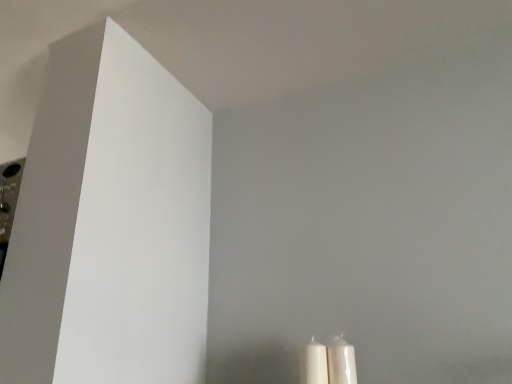
Question: Based on their sizes in the image, would you say white matte candle at lower right, the 2th candle when ordered from right to left, is bigger or smaller than white glossy candle at lower right, positioned as the first candle in right-to-left order?

Choices:
 (A) small
 (B) big

Answer: (B)

Question: Which is correct: white matte candle at lower right, which ranks as the first candle in left-to-right order, is inside white glossy candle at lower right, positioned as the first candle in right-to-left order, or outside of it?

Choices:
 (A) outside
 (B) inside

Answer: (A)

Question: In terms of height, does white matte candle at lower right, the 2th candle when ordered from right to left, look taller or shorter compared to white glossy candle at lower right, positioned as the first candle in right-to-left order?

Choices:
 (A) tall
 (B) short

Answer: (A)

Question: Is point (350, 374) closer or farther from the camera than point (311, 359)?

Choices:
 (A) farther
 (B) closer

Answer: (A)

Question: From their relative heights in the image, would you say white glossy candle at lower right, positioned as the first candle in right-to-left order, is taller or shorter than white matte candle at lower right, which ranks as the first candle in left-to-right order?

Choices:
 (A) short
 (B) tall

Answer: (A)

Question: From a real-world perspective, is white glossy candle at lower right, positioned as the first candle in right-to-left order, positioned above or below white matte candle at lower right, the 2th candle when ordered from right to left?

Choices:
 (A) above
 (B) below

Answer: (B)

Question: In the image, is white glossy candle at lower right, positioned as the first candle in right-to-left order, positioned in front of or behind white matte candle at lower right, the 2th candle when ordered from right to left?

Choices:
 (A) front
 (B) behind

Answer: (B)